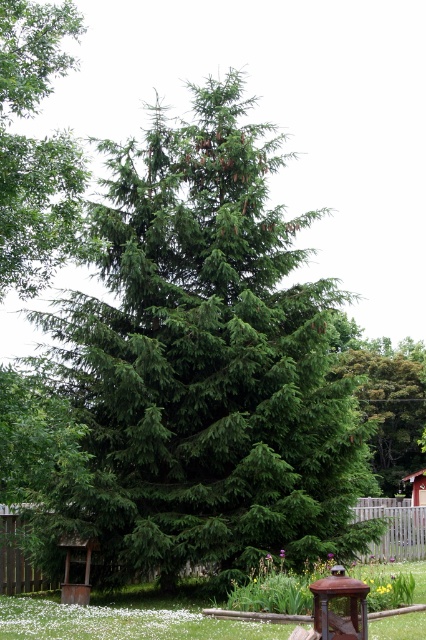
Question: Which point is closer to the camera?

Choices:
 (A) (34, 6)
 (B) (408, 369)

Answer: (A)

Question: Does green matte tree at upper left have a larger size compared to green matte tree at center?

Choices:
 (A) no
 (B) yes

Answer: (A)

Question: Is green matte tree at upper left further to the viewer compared to green matte tree at center?

Choices:
 (A) no
 (B) yes

Answer: (A)

Question: Which point appears closest to the camera in this image?

Choices:
 (A) (399, 381)
 (B) (5, 32)

Answer: (B)

Question: Is green matte tree at upper left positioned before green matte tree at center?

Choices:
 (A) yes
 (B) no

Answer: (A)

Question: Which object is farther from the camera taking this photo?

Choices:
 (A) green matte tree at upper left
 (B) green matte tree at center

Answer: (B)